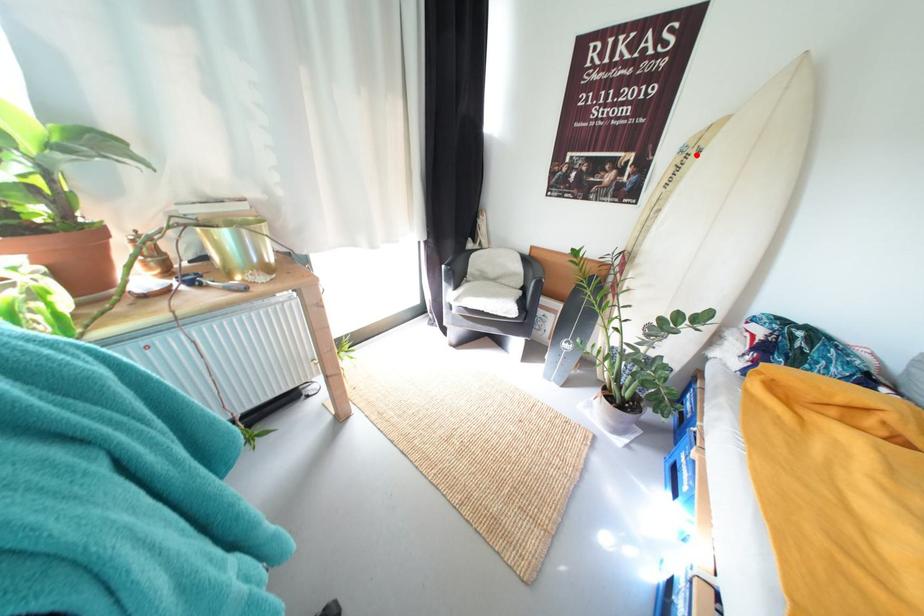
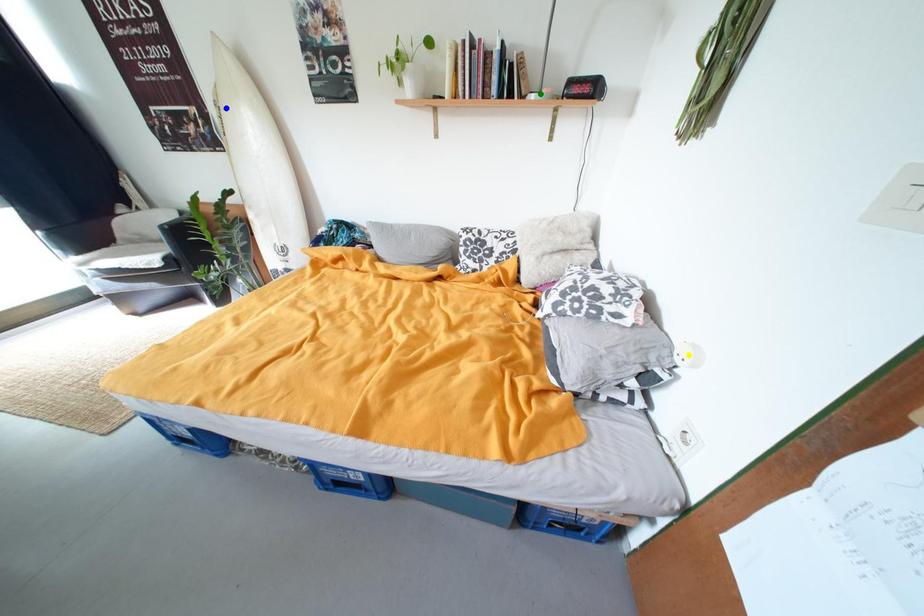
Question: I am providing you with two images of the same scene from different viewpoints. A red point is marked on the first image. You are given multiple points on the second image. In image 2, which mark is for the same physical point as the one in image 1?

Choices:
 (A) yellow point
 (B) blue point
 (C) green point

Answer: (B)